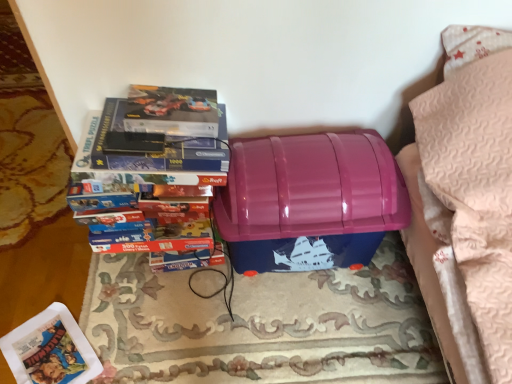
At what (x,y) coordinates should I click in order to perform the action: click on vacant area that lies between glossy plastic storage box at center and matte plastic paperback book at lower left. Please return your answer as a coordinate pair (x, y). Image resolution: width=512 pixels, height=384 pixels. Looking at the image, I should click on (188, 319).